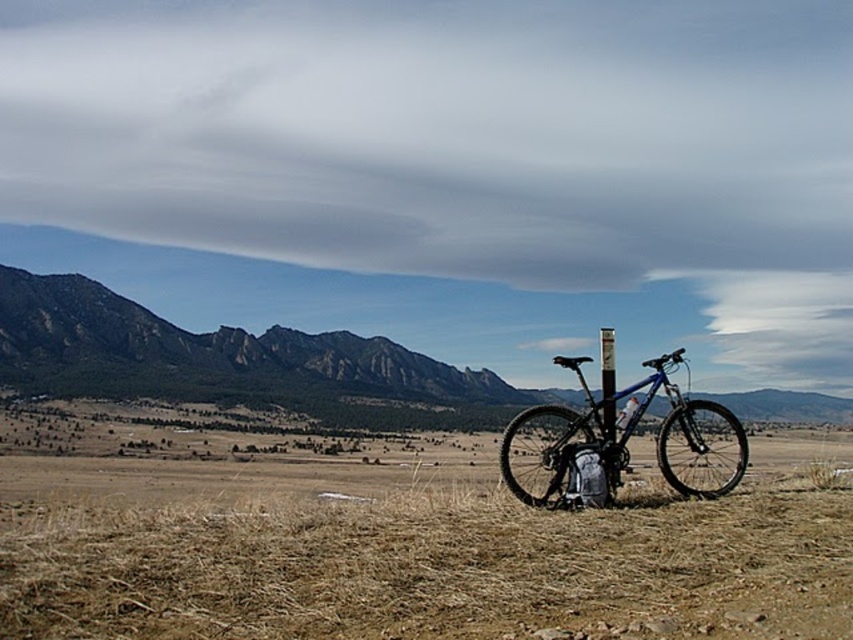
Question: Is rugged brown mountain at left further to the viewer compared to blue matte bicycle at center?

Choices:
 (A) no
 (B) yes

Answer: (B)

Question: Does rugged brown mountain at left lie in front of blue matte bicycle at center?

Choices:
 (A) yes
 (B) no

Answer: (B)

Question: Which point appears farthest from the camera in this image?

Choices:
 (A) (672, 419)
 (B) (198, 365)

Answer: (B)

Question: Does rugged brown mountain at left appear on the right side of blue matte bicycle at center?

Choices:
 (A) yes
 (B) no

Answer: (B)

Question: Which object appears closest to the camera in this image?

Choices:
 (A) blue matte bicycle at center
 (B) rugged brown mountain at left

Answer: (A)